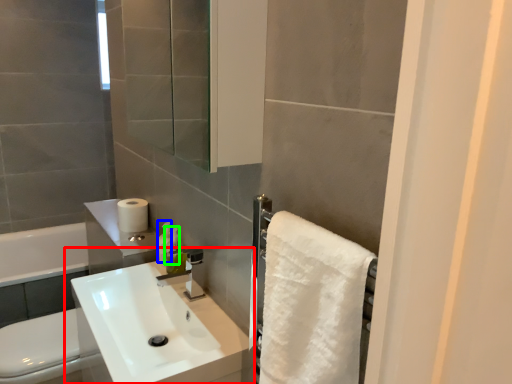
Question: Estimate the real-world distances between objects in this image. Which object is farther from sink (highlighted by a red box), toiletry (highlighted by a blue box) or soap dispenser (highlighted by a green box)?

Choices:
 (A) toiletry
 (B) soap dispenser

Answer: (A)